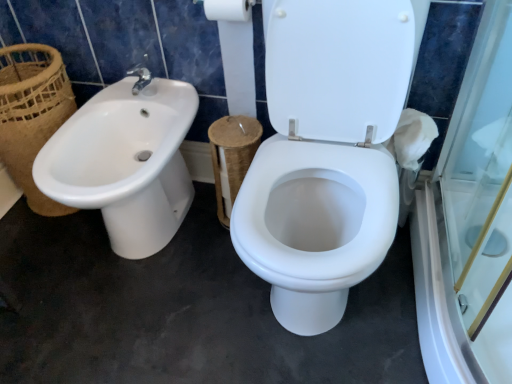
This screenshot has height=384, width=512. Find the location of `white glossy sink at left`. white glossy sink at left is located at coordinates (125, 162).

Measure the distance between point (218,30) and camera.

The depth of point (218,30) is 1.25 meters.

Measure the distance between brown woven basket at left and camera.

A distance of 3.89 feet exists between brown woven basket at left and camera.

You are a GUI agent. You are given a task and a screenshot of the screen. Output one action in this format:
    pyautogui.click(x=<x>, y=<y>)
    Task: Click on the white glossy sink at left
    Image resolution: width=512 pixels, height=384 pixels.
    Given the screenshot: What is the action you would take?
    tap(125, 162)

Based on the photo, which object is further away from the camera, white glossy sink at left or white cardboard toilet paper at upper center?

Positioned behind is white cardboard toilet paper at upper center.

Considering the points (86, 102) and (229, 44), which point is behind, point (86, 102) or point (229, 44)?

The point (86, 102) is farther from the camera.

Measure the distance between white glossy sink at left and white cardboard toilet paper at upper center.

The distance of white glossy sink at left from white cardboard toilet paper at upper center is 35.34 centimeters.

Does brown woven basket at left have a greater width compared to white glossy sink at left?

No.

Is brown woven basket at left not inside white glossy sink at left?

Yes.

Could you tell me if brown woven basket at left is turned towards white glossy sink at left?

No, brown woven basket at left is not turned towards white glossy sink at left.

Is white glossy sink at left next to brown woven basket at left?

No, white glossy sink at left is not in contact with brown woven basket at left.

Between white glossy sink at left and brown woven basket at left, which one has smaller width?

brown woven basket at left is thinner.

Between point (168, 230) and point (56, 204), which one is positioned in front?

Positioned in front is point (168, 230).

Between white cardboard toilet paper at upper center and brown woven basket at left, which one appears on the left side from the viewer's perspective?

From the viewer's perspective, brown woven basket at left appears more on the left side.

Is white cardboard toilet paper at upper center aimed at brown woven basket at left?

No, white cardboard toilet paper at upper center is not turned towards brown woven basket at left.

Find the location of `basket located underneath the white cardboard toilet paper at upper center (from a real-world perspective)`. basket located underneath the white cardboard toilet paper at upper center (from a real-world perspective) is located at coordinates (32, 115).

From the image's perspective, does white cardboard toilet paper at upper center appear lower than brown woven basket at left?

No.

From a real-world perspective, is brown woven basket at left located beneath white cardboard toilet paper at upper center?

Yes, from a real-world perspective, brown woven basket at left is beneath white cardboard toilet paper at upper center.

Considering the relative sizes of brown woven basket at left and white cardboard toilet paper at upper center in the image provided, is brown woven basket at left smaller than white cardboard toilet paper at upper center?

Incorrect, brown woven basket at left is not smaller in size than white cardboard toilet paper at upper center.

Considering the positions of objects brown woven basket at left and white cardboard toilet paper at upper center in the image provided, who is more to the right, brown woven basket at left or white cardboard toilet paper at upper center?

From the viewer's perspective, white cardboard toilet paper at upper center appears more on the right side.

Is white glossy sink at left located within white cardboard toilet paper at upper center?

Actually, white glossy sink at left is outside white cardboard toilet paper at upper center.

From the image's perspective, who appears lower, white cardboard toilet paper at upper center or white glossy sink at left?

white glossy sink at left is shown below in the image.

How many degrees apart are the facing directions of white cardboard toilet paper at upper center and white glossy sink at left?

1.55 degrees.

Is white cardboard toilet paper at upper center in contact with white glossy sink at left?

No, white cardboard toilet paper at upper center is not in contact with white glossy sink at left.

Image resolution: width=512 pixels, height=384 pixels. I want to click on toilet paper located on the right of white glossy sink at left, so click(236, 52).

This screenshot has width=512, height=384. Identify the location of basket above the white glossy sink at left (from the image's perspective). (32, 115).

Considering their positions, is white glossy sink at left positioned further to brown woven basket at left than white cardboard toilet paper at upper center?

white cardboard toilet paper at upper center is positioned further to the anchor brown woven basket at left.

Estimate the real-world distances between objects in this image. Which object is closer to brown woven basket at left, white cardboard toilet paper at upper center or white glossy sink at left?

Among the two, white glossy sink at left is located nearer to brown woven basket at left.

Considering their positions, is brown woven basket at left positioned further to white cardboard toilet paper at upper center than white glossy sink at left?

The object further to white cardboard toilet paper at upper center is brown woven basket at left.

From the image, which object appears to be nearer to white glossy sink at left, brown woven basket at left or white cardboard toilet paper at upper center?

brown woven basket at left is positioned closer to the anchor white glossy sink at left.

Considering their positions, is white glossy sink at left positioned further to white cardboard toilet paper at upper center than brown woven basket at left?

brown woven basket at left.

When comparing their distances from white glossy sink at left, does white cardboard toilet paper at upper center or brown woven basket at left seem further?

white cardboard toilet paper at upper center is positioned further to the anchor white glossy sink at left.

Find the location of a particular element. Image resolution: width=512 pixels, height=384 pixels. sink between brown woven basket at left and white cardboard toilet paper at upper center from left to right is located at coordinates (125, 162).